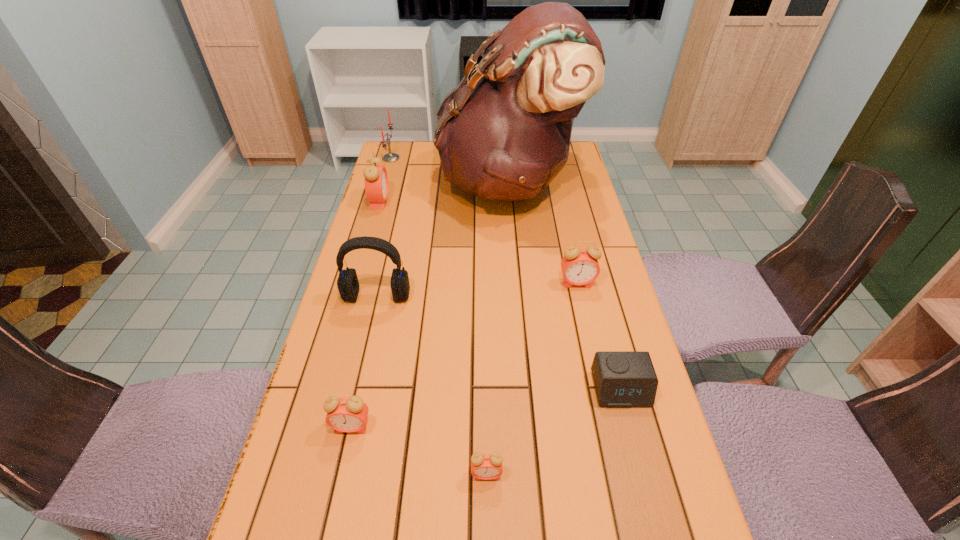
Locate an element on the screen. Image resolution: width=960 pixels, height=540 pixels. the tallest object is located at coordinates (505, 134).

Locate an element on the screen. headset is located at coordinates (348, 285).

The width and height of the screenshot is (960, 540). What are the coordinates of `the leftmost alarm clock` in the screenshot? It's located at pos(376,180).

You are a GUI agent. You are given a task and a screenshot of the screen. Output one action in this format:
    pyautogui.click(x=<x>, y=<y>)
    Task: Click on the farthest pink alarm clock
    Image resolution: width=960 pixels, height=540 pixels.
    Given the screenshot: What is the action you would take?
    pyautogui.click(x=376, y=180)

Where is `candle`? This screenshot has width=960, height=540. candle is located at coordinates coord(389,157).

Where is `the fourth shortest object`? The height and width of the screenshot is (540, 960). the fourth shortest object is located at coordinates (579, 267).

The height and width of the screenshot is (540, 960). What are the coordinates of `the rightmost pink alarm clock` in the screenshot? It's located at (579, 267).

In order to click on the second nearest alarm clock in this screenshot , I will do [344, 414].

The image size is (960, 540). I want to click on the second pink alarm clock from left to right, so click(x=344, y=414).

Locate an element on the screen. This screenshot has width=960, height=540. the nearest object is located at coordinates (486, 466).